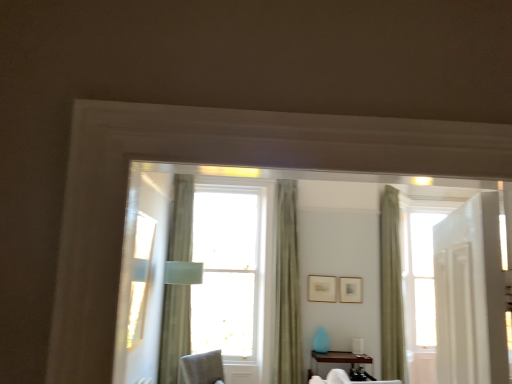
This screenshot has width=512, height=384. Identify the location of matte silver picture frame at center, which appears as the 2th picture frame when viewed from the left. (350, 290).

Measure the distance between green fabric curtain at right, the 3th curtain from the left, and camera.

13.63 feet.

Find the location of a particular element. This screenshot has height=384, width=512. wooden picture frame at center, the first picture frame from the left is located at coordinates (322, 288).

What are the coordinates of `green fabric curtain at center, which is the second curtain from right to left` in the screenshot? It's located at (287, 288).

This screenshot has width=512, height=384. I want to click on matte silver picture frame at center, which is the 1th picture frame from right to left, so click(x=350, y=290).

Does green fabric curtain at center, the 2th curtain in the left-to-right sequence, have a lesser width compared to brown wood table at lower center?

Yes, green fabric curtain at center, the 2th curtain in the left-to-right sequence, is thinner than brown wood table at lower center.

How many degrees apart are the facing directions of green fabric curtain at center, the 2th curtain in the left-to-right sequence, and brown wood table at lower center?

The angle between the facing direction of green fabric curtain at center, the 2th curtain in the left-to-right sequence, and the facing direction of brown wood table at lower center is 0.527 degrees.

Is green fabric curtain at center, the 2th curtain in the left-to-right sequence, oriented away from brown wood table at lower center?

That's not correct — green fabric curtain at center, the 2th curtain in the left-to-right sequence, is not looking away from brown wood table at lower center.

Is green fabric curtain at center, which is the second curtain from right to left, next to brown wood table at lower center and touching it?

There is a gap between green fabric curtain at center, which is the second curtain from right to left, and brown wood table at lower center.

Can you confirm if brown wood table at lower center is wider than wooden picture frame at center, which appears as the second picture frame when viewed from the right?

Indeed, brown wood table at lower center has a greater width compared to wooden picture frame at center, which appears as the second picture frame when viewed from the right.

Is brown wood table at lower center not close to wooden picture frame at center, the first picture frame from the left?

brown wood table at lower center is actually quite close to wooden picture frame at center, the first picture frame from the left.

From a real-world perspective, which object rests below the other?

brown wood table at lower center, from a real-world perspective.

Does light beige fabric curtain at center, the 1th curtain viewed from the left, lie in front of green fabric curtain at center, which is the second curtain from right to left?

Yes, the depth of light beige fabric curtain at center, the 1th curtain viewed from the left, is less than that of green fabric curtain at center, which is the second curtain from right to left.

Where is `curtain in front of the green fabric curtain at center, which is the second curtain from right to left`? This screenshot has height=384, width=512. curtain in front of the green fabric curtain at center, which is the second curtain from right to left is located at coordinates (174, 332).

From the picture: Can you confirm if light beige fabric curtain at center, placed as the 3th curtain when sorted from right to left, is positioned to the right of green fabric curtain at center, the 2th curtain in the left-to-right sequence?

In fact, light beige fabric curtain at center, placed as the 3th curtain when sorted from right to left, is to the left of green fabric curtain at center, the 2th curtain in the left-to-right sequence.

In the image, is matte silver picture frame at center, which is the 1th picture frame from right to left, positioned in front of or behind green fabric curtain at right, which appears as the first curtain when viewed from the right?

Visually, matte silver picture frame at center, which is the 1th picture frame from right to left, is located behind green fabric curtain at right, which appears as the first curtain when viewed from the right.

How many degrees apart are the facing directions of matte silver picture frame at center, which appears as the 2th picture frame when viewed from the left, and green fabric curtain at right, which appears as the first curtain when viewed from the right?

matte silver picture frame at center, which appears as the 2th picture frame when viewed from the left, and green fabric curtain at right, which appears as the first curtain when viewed from the right, are facing 58.9 degrees away from each other.

Does matte silver picture frame at center, which is the 1th picture frame from right to left, turn towards green fabric curtain at right, the 3th curtain from the left?

No, matte silver picture frame at center, which is the 1th picture frame from right to left, is not turned towards green fabric curtain at right, the 3th curtain from the left.

Does matte silver picture frame at center, which appears as the 2th picture frame when viewed from the left, appear on the left side of green fabric curtain at right, which appears as the first curtain when viewed from the right?

Indeed, matte silver picture frame at center, which appears as the 2th picture frame when viewed from the left, is positioned on the left side of green fabric curtain at right, which appears as the first curtain when viewed from the right.

Is brown wood table at lower center taller than matte silver picture frame at center, which appears as the 2th picture frame when viewed from the left?

Correct, brown wood table at lower center is much taller as matte silver picture frame at center, which appears as the 2th picture frame when viewed from the left.

Is brown wood table at lower center bigger or smaller than matte silver picture frame at center, which is the 1th picture frame from right to left?

In the image, brown wood table at lower center appears to be larger than matte silver picture frame at center, which is the 1th picture frame from right to left.

Can you tell me how much brown wood table at lower center and matte silver picture frame at center, which is the 1th picture frame from right to left, differ in facing direction?

2.4 degrees.

Find the location of a particular element. the 2nd picture frame behind the brown wood table at lower center is located at coordinates (350, 290).

Choose the correct answer: Is matte silver picture frame at center, which appears as the 2th picture frame when viewed from the left, inside transparent glass window at center or outside it?

matte silver picture frame at center, which appears as the 2th picture frame when viewed from the left, is not inside transparent glass window at center, it's outside.

Is matte silver picture frame at center, which appears as the 2th picture frame when viewed from the left, bigger or smaller than transparent glass window at center?

In the image, matte silver picture frame at center, which appears as the 2th picture frame when viewed from the left, appears to be smaller than transparent glass window at center.

Between matte silver picture frame at center, which appears as the 2th picture frame when viewed from the left, and transparent glass window at center, which one appears on the right side from the viewer's perspective?

Positioned to the right is matte silver picture frame at center, which appears as the 2th picture frame when viewed from the left.

What's the angular difference between matte silver picture frame at center, which appears as the 2th picture frame when viewed from the left, and transparent glass window at center's facing directions?

1.89 degrees.

Can you confirm if transparent glass window at center is wider than wooden picture frame at center, which appears as the second picture frame when viewed from the right?

Yes, transparent glass window at center is wider than wooden picture frame at center, which appears as the second picture frame when viewed from the right.

Between transparent glass window at center and wooden picture frame at center, the first picture frame from the left, which one has larger size?

Bigger between the two is transparent glass window at center.

Which is more to the left, transparent glass window at center or wooden picture frame at center, the first picture frame from the left?

Positioned to the left is transparent glass window at center.

How many degrees apart are the facing directions of transparent glass window at center and wooden picture frame at center, which appears as the second picture frame when viewed from the right?

1.89 degrees.

From the image's perspective, which curtain is the 2nd one above the brown wood table at lower center? Please provide its 2D coordinates.

[(287, 288)]

Find the location of a particular element. Image resolution: width=512 pixels, height=384 pixels. table that appears below the wooden picture frame at center, the first picture frame from the left (from the image's perspective) is located at coordinates (339, 358).

Based on their spatial positions, is matte silver picture frame at center, which is the 1th picture frame from right to left, or transparent glass window at center further from light beige fabric curtain at center, the 1th curtain viewed from the left?

matte silver picture frame at center, which is the 1th picture frame from right to left, is positioned further to the anchor light beige fabric curtain at center, the 1th curtain viewed from the left.

When comparing their distances from light beige fabric curtain at center, placed as the 3th curtain when sorted from right to left, does matte silver picture frame at center, which appears as the 2th picture frame when viewed from the left, or wooden picture frame at center, the first picture frame from the left, seem closer?

wooden picture frame at center, the first picture frame from the left, is positioned closer to the anchor light beige fabric curtain at center, placed as the 3th curtain when sorted from right to left.

Estimate the real-world distances between objects in this image. Which object is further from light beige fabric curtain at center, placed as the 3th curtain when sorted from right to left, transparent glass window at center or green fabric curtain at right, which appears as the first curtain when viewed from the right?

green fabric curtain at right, which appears as the first curtain when viewed from the right, is further to light beige fabric curtain at center, placed as the 3th curtain when sorted from right to left.

From the image, which object appears to be nearer to green fabric curtain at center, which is the second curtain from right to left, green fabric curtain at right, the 3th curtain from the left, or light beige fabric curtain at center, placed as the 3th curtain when sorted from right to left?

green fabric curtain at right, the 3th curtain from the left.

Considering their positions, is matte silver picture frame at center, which appears as the 2th picture frame when viewed from the left, positioned further to green fabric curtain at right, which appears as the first curtain when viewed from the right, than wooden picture frame at center, the first picture frame from the left?

wooden picture frame at center, the first picture frame from the left.

Looking at the image, which one is located closer to transparent glass window at center, wooden picture frame at center, which appears as the second picture frame when viewed from the right, or brown wood table at lower center?

wooden picture frame at center, which appears as the second picture frame when viewed from the right, is positioned closer to the anchor transparent glass window at center.

Looking at this image, estimate the real-world distances between objects in this image. Which object is closer to transparent glass window at center, green fabric curtain at right, which appears as the first curtain when viewed from the right, or brown wood table at lower center?

brown wood table at lower center lies closer to transparent glass window at center than the other object.

Looking at the image, which one is located further to wooden picture frame at center, which appears as the second picture frame when viewed from the right, green fabric curtain at center, which is the second curtain from right to left, or matte silver picture frame at center, which appears as the 2th picture frame when viewed from the left?

Among the two, green fabric curtain at center, which is the second curtain from right to left, is located further to wooden picture frame at center, which appears as the second picture frame when viewed from the right.

Image resolution: width=512 pixels, height=384 pixels. I want to click on window between light beige fabric curtain at center, the 1th curtain viewed from the left, and green fabric curtain at right, the 3th curtain from the left, from left to right, so click(x=287, y=288).

Locate an element on the screen. picture frame between transparent glass window at center and brown wood table at lower center is located at coordinates (322, 288).

Identify the location of window located between light beige fabric curtain at center, the 1th curtain viewed from the left, and brown wood table at lower center in the left-right direction. (287, 288).

Find the location of a particular element. picture frame between wooden picture frame at center, the first picture frame from the left, and green fabric curtain at right, which appears as the first curtain when viewed from the right is located at coordinates (350, 290).